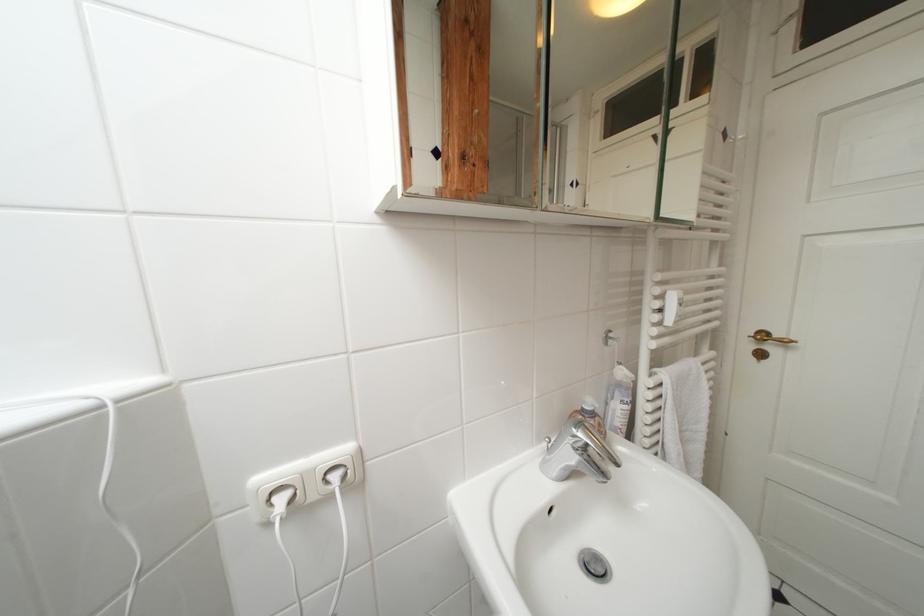
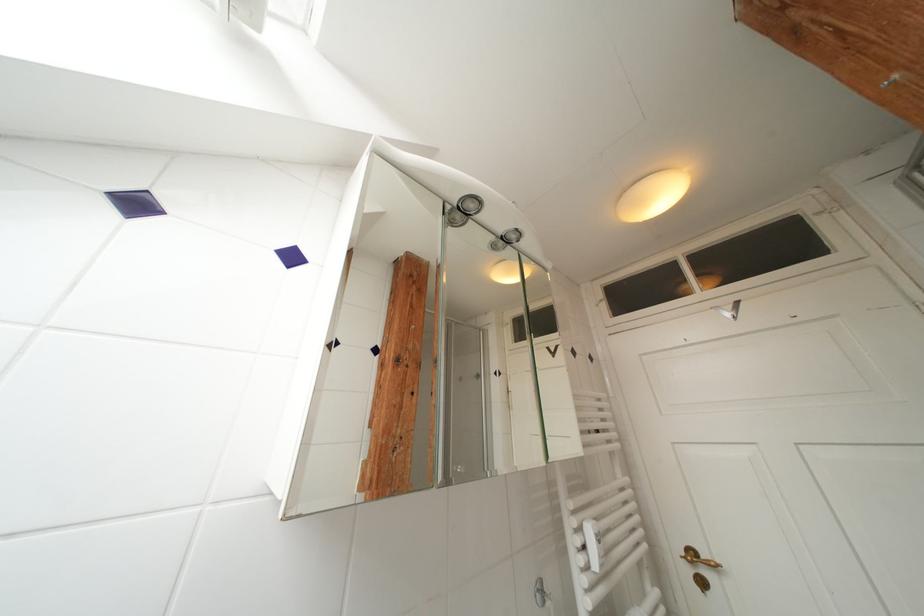
Question: The first image is from the beginning of the video and the second image is from the end. How did the camera likely rotate when shooting the video?

Choices:
 (A) Left
 (B) Right
 (C) Up
 (D) Down

Answer: (C)